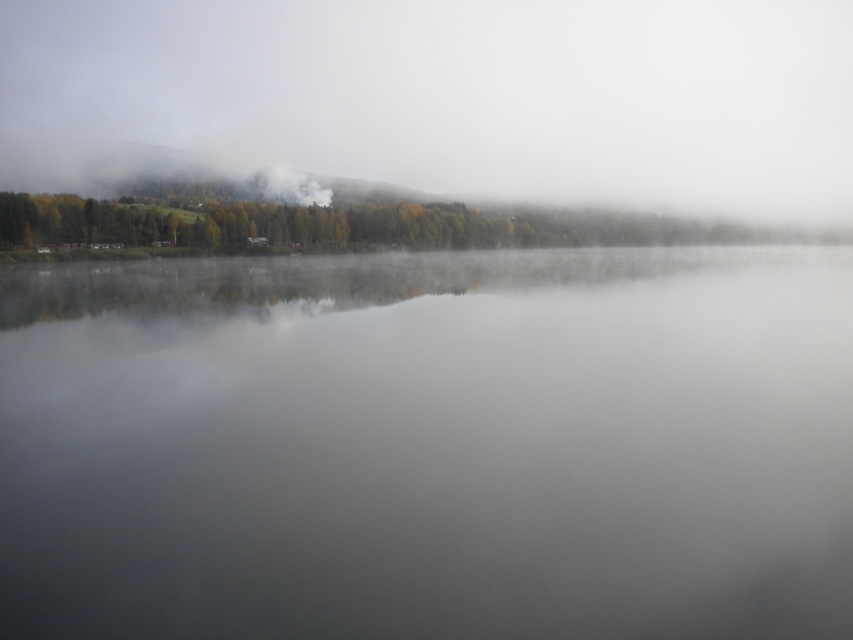
You are standing at the edge of the lake in the serene misty landscape. You notice two points marked on the image. The first point is at coordinate point [552,563] and the second is at point [239,204]. Which of these two points is closer to you, the observer?

Point [552,563] is in front of point [239,204], so the first point is closer to you.